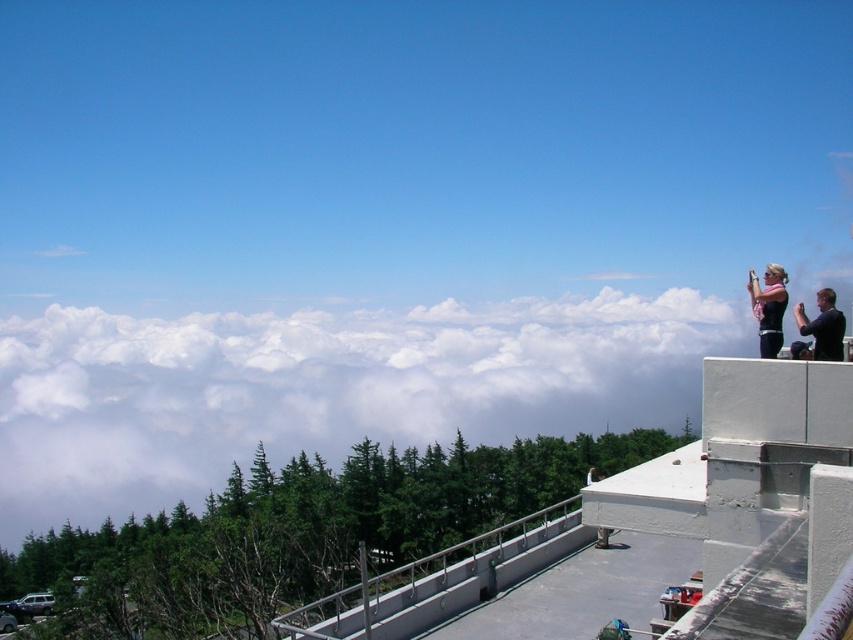
This screenshot has width=853, height=640. Identify the location of pink fabric at upper right. (769, 307).

Can you confirm if pink fabric at upper right is smaller than dark hair person at upper right?

Yes, pink fabric at upper right is smaller than dark hair person at upper right.

Between point (761, 352) and point (601, 476), which one is positioned in front?

Point (761, 352) is more forward.

Identify the location of pink fabric at upper right. (769, 307).

Between point (223, 444) and point (601, 536), which one is positioned in front?

Positioned in front is point (601, 536).

At what (x,y) coordinates should I click in order to perform the action: click on white fluffy cloud at upper center. Please return your answer as a coordinate pair (x, y). Looking at the image, I should click on (325, 388).

Is point (706, 298) farther from camera compared to point (601, 547)?

Yes, it is behind point (601, 547).

Locate an element on the screen. white fluffy cloud at upper center is located at coordinates (325, 388).

Does white fluffy cloud at upper center appear over black matte shirt at upper right?

Incorrect, white fluffy cloud at upper center is not positioned above black matte shirt at upper right.

Between white fluffy cloud at upper center and black matte shirt at upper right, which one appears on the right side from the viewer's perspective?

black matte shirt at upper right is more to the right.

Measure the distance between point (39, 513) and camera.

419.64 meters

Where is `white fluffy cloud at upper center`? The image size is (853, 640). white fluffy cloud at upper center is located at coordinates (325, 388).